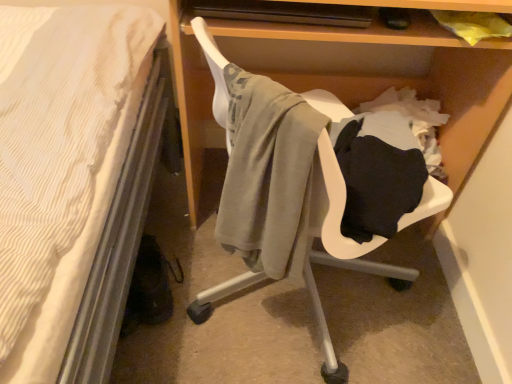
Question: Should I look upward or downward to see wooden shelf at center?

Choices:
 (A) down
 (B) up

Answer: (B)

Question: From the image's perspective, would you say matte gray swivel chair at center is positioned over wooden shelf at center?

Choices:
 (A) yes
 (B) no

Answer: (B)

Question: Is matte gray swivel chair at center positioned with its back to wooden shelf at center?

Choices:
 (A) no
 (B) yes

Answer: (A)

Question: Can you confirm if matte gray swivel chair at center is wider than wooden shelf at center?

Choices:
 (A) yes
 (B) no

Answer: (B)

Question: Is matte gray swivel chair at center behind wooden shelf at center?

Choices:
 (A) yes
 (B) no

Answer: (B)

Question: Would you say matte gray swivel chair at center is a long distance from wooden shelf at center?

Choices:
 (A) no
 (B) yes

Answer: (A)

Question: From the image's perspective, is matte gray swivel chair at center located beneath wooden shelf at center?

Choices:
 (A) yes
 (B) no

Answer: (A)

Question: From a real-world perspective, is wooden shelf at center located higher than matte gray swivel chair at center?

Choices:
 (A) yes
 (B) no

Answer: (B)

Question: Does wooden shelf at center come behind matte gray swivel chair at center?

Choices:
 (A) yes
 (B) no

Answer: (A)

Question: Can we say wooden shelf at center lies outside matte gray swivel chair at center?

Choices:
 (A) yes
 (B) no

Answer: (A)

Question: Can you confirm if wooden shelf at center is thinner than matte gray swivel chair at center?

Choices:
 (A) no
 (B) yes

Answer: (A)

Question: Considering the relative sizes of wooden shelf at center and matte gray swivel chair at center in the image provided, is wooden shelf at center wider than matte gray swivel chair at center?

Choices:
 (A) no
 (B) yes

Answer: (B)

Question: Does wooden shelf at center have a lesser height compared to matte gray swivel chair at center?

Choices:
 (A) no
 (B) yes

Answer: (A)

Question: Considering the relative positions of matte gray swivel chair at center and wooden shelf at center in the image provided, is matte gray swivel chair at center to the left or to the right of wooden shelf at center?

Choices:
 (A) right
 (B) left

Answer: (B)